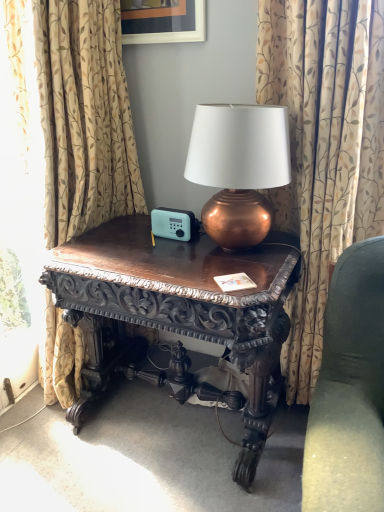
Identify the location of empty space that is ontop of dark wood carved table at center (from a real-world perspective). click(x=178, y=250).